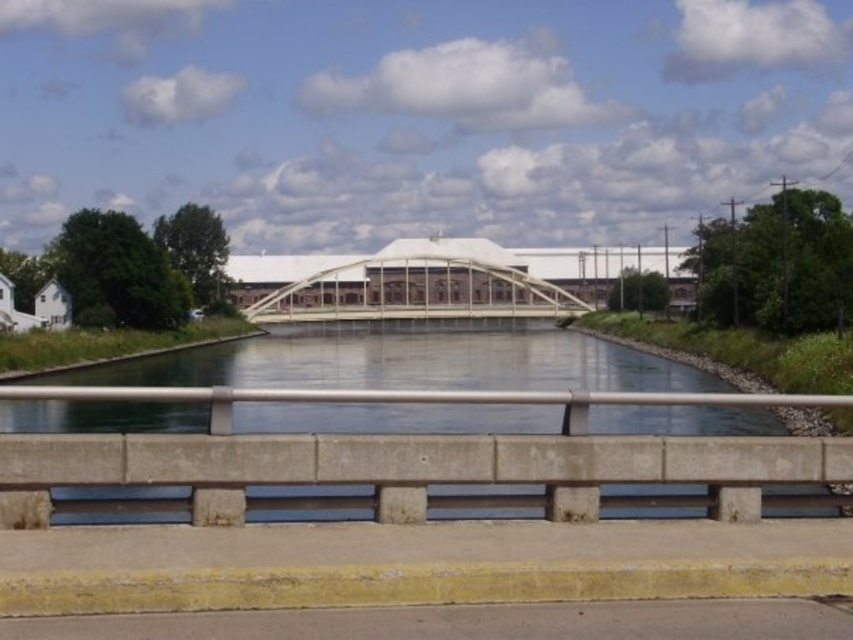
Question: Does clear concrete water at center appear on the left side of white metal bridge at center?

Choices:
 (A) yes
 (B) no

Answer: (B)

Question: Does clear concrete water at center have a greater width compared to white metal bridge at center?

Choices:
 (A) yes
 (B) no

Answer: (A)

Question: Which of the following is the farthest from the observer?

Choices:
 (A) (489, 307)
 (B) (668, 385)

Answer: (A)

Question: Is clear concrete water at center bigger than white metal bridge at center?

Choices:
 (A) no
 (B) yes

Answer: (B)